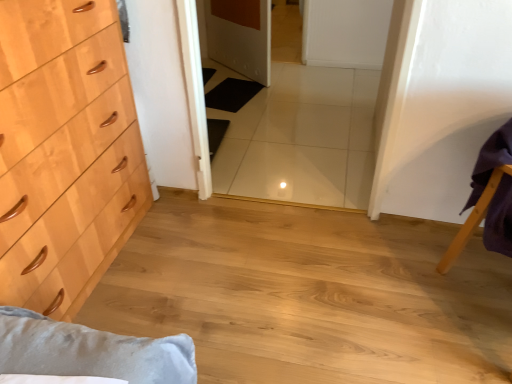
What do you see at coordinates (302, 138) in the screenshot? I see `white glossy tile at center` at bounding box center [302, 138].

In order to click on white glossy tile at center in this screenshot , I will do (x=302, y=138).

The height and width of the screenshot is (384, 512). I want to click on white glossy tile at center, so click(x=302, y=138).